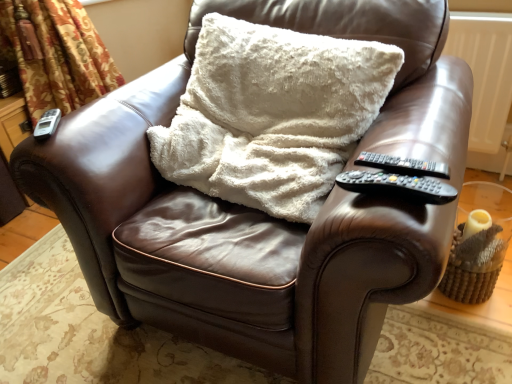
Question: Is black plastic remote at right, the 3th remote viewed from the left, shorter than floral fabric curtain at left?

Choices:
 (A) yes
 (B) no

Answer: (A)

Question: Does black plastic remote at right, the 3th remote viewed from the left, have a smaller size compared to floral fabric curtain at left?

Choices:
 (A) no
 (B) yes

Answer: (B)

Question: Does black plastic remote at right, positioned as the first remote in right-to-left order, touch floral fabric curtain at left?

Choices:
 (A) no
 (B) yes

Answer: (A)

Question: Is black plastic remote at right, the second remote when ordered from bottom to top, facing away from floral fabric curtain at left?

Choices:
 (A) no
 (B) yes

Answer: (A)

Question: From a real-world perspective, is black plastic remote at right, which is the second remote in front-to-back order, positioned over floral fabric curtain at left based on gravity?

Choices:
 (A) yes
 (B) no

Answer: (A)

Question: Considering their positions, is black plastic remote at right armrest, the 1th remote positioned from the front, located in front of or behind black plastic remote at right, which is the second remote in front-to-back order?

Choices:
 (A) front
 (B) behind

Answer: (A)

Question: From the image's perspective, is black plastic remote at right armrest, marked as the 2th remote in a left-to-right arrangement, above or below black plastic remote at right, which is the second remote in front-to-back order?

Choices:
 (A) below
 (B) above

Answer: (A)

Question: Is point (438, 193) positioned closer to the camera than point (375, 157)?

Choices:
 (A) farther
 (B) closer

Answer: (B)

Question: Would you say black plastic remote at right armrest, placed as the third remote when sorted from top to bottom, is to the left or to the right of black plastic remote at right, marked as the 2th remote in a back-to-front arrangement, in the picture?

Choices:
 (A) left
 (B) right

Answer: (A)

Question: Which is correct: white fluffy pillow at center is inside black plastic remote at right armrest, the 1th remote positioned from the front, or outside of it?

Choices:
 (A) inside
 (B) outside

Answer: (B)

Question: From a real-world perspective, is white fluffy pillow at center physically located above or below black plastic remote at right armrest, marked as the 2th remote in a left-to-right arrangement?

Choices:
 (A) above
 (B) below

Answer: (B)

Question: Would you say white fluffy pillow at center is to the left or to the right of black plastic remote at right armrest, which is the third remote from back to front, in the picture?

Choices:
 (A) left
 (B) right

Answer: (A)

Question: Is white fluffy pillow at center wider or thinner than black plastic remote at right armrest, positioned as the second remote in right-to-left order?

Choices:
 (A) thin
 (B) wide

Answer: (B)

Question: From a real-world perspective, is silver metallic remote at upper left, acting as the first remote starting from the left, positioned above or below white fluffy pillow at center?

Choices:
 (A) above
 (B) below

Answer: (A)

Question: In terms of height, does silver metallic remote at upper left, the third remote when ordered from front to back, look taller or shorter compared to white fluffy pillow at center?

Choices:
 (A) short
 (B) tall

Answer: (A)